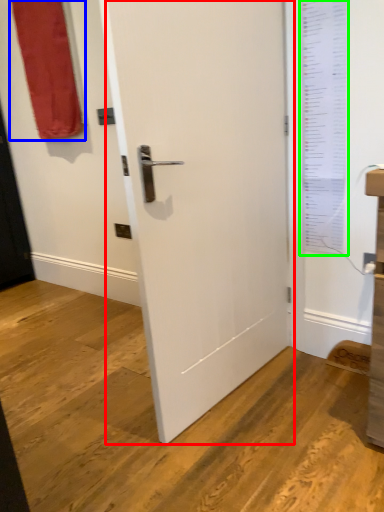
Question: Based on their relative distances, which object is farther from door (highlighted by a red box)? Choose from curtain (highlighted by a blue box) and window screen (highlighted by a green box).

Choices:
 (A) curtain
 (B) window screen

Answer: (A)